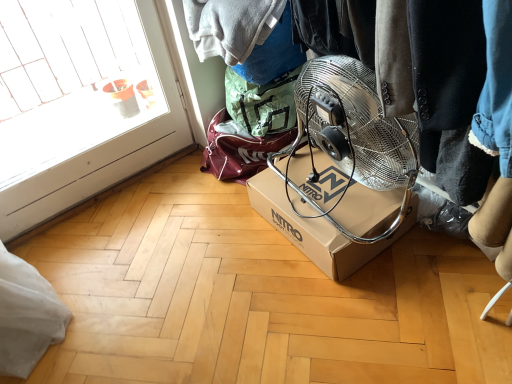
At what (x,y) coordinates should I click in order to perform the action: click on vacant space to the right of transparent glass door at left. Please return your answer as a coordinate pair (x, y). The width and height of the screenshot is (512, 384). Looking at the image, I should click on (196, 211).